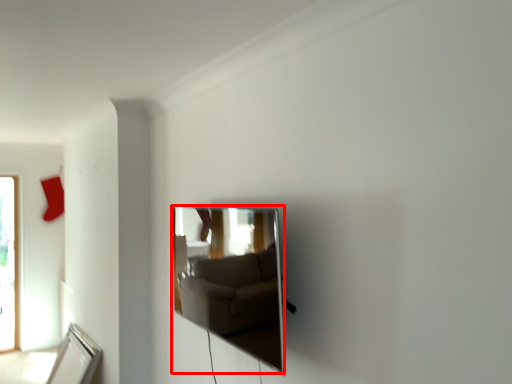
Question: From the image, what is the correct spatial relationship of mirror (annotated by the red box) in relation to mirror?

Choices:
 (A) left
 (B) right

Answer: (B)